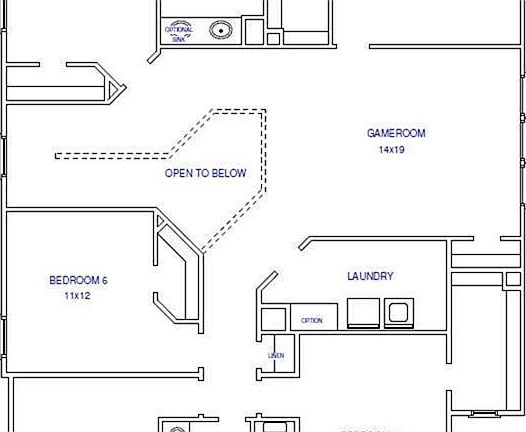
Identify the location of room. This screenshot has width=526, height=432. (80, 76).